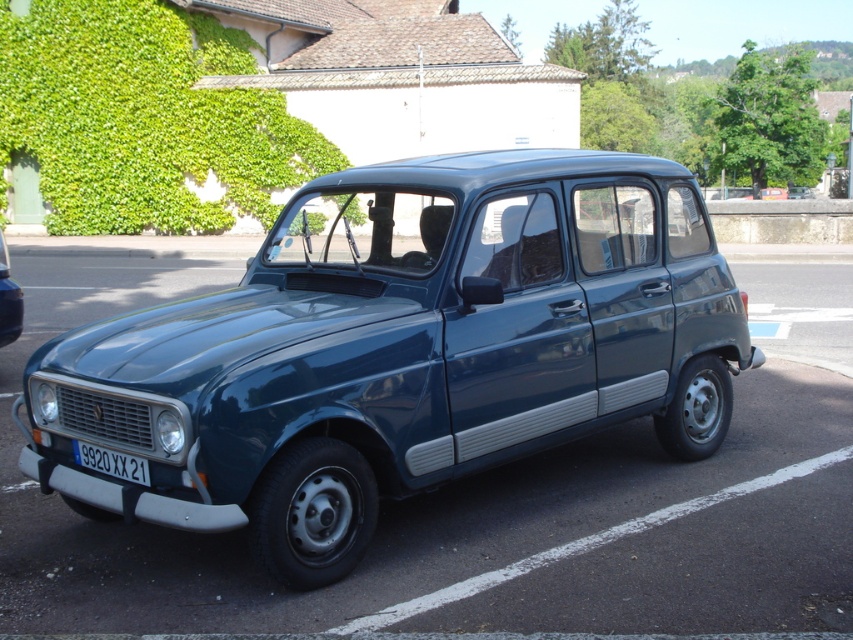
Is point (200, 170) in front of point (83, 448)?

No, it is behind (83, 448).

Can you confirm if green leafy hedge at upper left is shorter than white plastic license plate at lower center?

No.

Is point (50, 161) farther from camera compared to point (140, 477)?

Yes, it is.

Identify the location of green leafy hedge at upper left. This screenshot has width=853, height=640. (144, 116).

Is white plastic license plate at lower center bigger than metallic blue car at lower left?

No, white plastic license plate at lower center is not bigger than metallic blue car at lower left.

Is point (91, 452) closer to viewer compared to point (6, 304)?

Yes, point (91, 452) is in front of point (6, 304).

Identify the location of white plastic license plate at lower center. The height and width of the screenshot is (640, 853). (111, 461).

Is point (537, 419) in front of point (10, 300)?

Yes, point (537, 419) is closer to viewer.

From the picture: Does metallic blue car at center have a lesser width compared to metallic blue car at lower left?

Incorrect, metallic blue car at center's width is not less than metallic blue car at lower left's.

The width and height of the screenshot is (853, 640). What are the coordinates of `metallic blue car at center` in the screenshot? It's located at (399, 349).